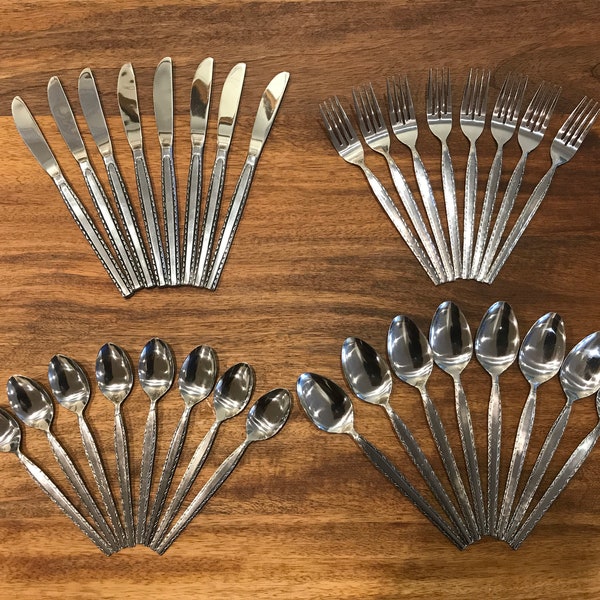
You are a GUI agent. You are given a task and a screenshot of the screen. Output one action in this format:
    pyautogui.click(x=<x>, y=<y>)
    Task: Click on the knife handle
    This screenshot has width=600, height=600.
    Given the screenshot: What is the action you would take?
    pyautogui.click(x=81, y=214), pyautogui.click(x=106, y=211), pyautogui.click(x=126, y=213), pyautogui.click(x=151, y=217), pyautogui.click(x=170, y=206), pyautogui.click(x=191, y=209), pyautogui.click(x=209, y=211), pyautogui.click(x=229, y=219)